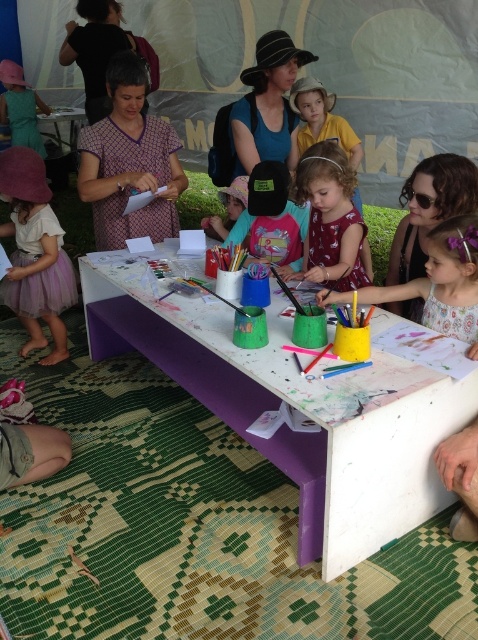
Is purple tulle skirt at lower left wider than matte pink dress at center?

Correct, the width of purple tulle skirt at lower left exceeds that of matte pink dress at center.

Between purple tulle skirt at lower left and matte pink dress at center, which one appears on the left side from the viewer's perspective?

Positioned to the left is purple tulle skirt at lower left.

Who is more distant from viewer, (63, 344) or (327, 188)?

Positioned behind is point (63, 344).

You are a GUI agent. You are given a task and a screenshot of the screen. Output one action in this format:
    pyautogui.click(x=<x>, y=<y>)
    Task: Click on the purple tulle skirt at lower left
    This screenshot has height=640, width=478.
    Given the screenshot: What is the action you would take?
    pyautogui.click(x=34, y=253)

Can you confirm if purple painted wood table at center is taller than pink fabric hat at center?

Yes, purple painted wood table at center is taller than pink fabric hat at center.

What do you see at coordinates (297, 408) in the screenshot? This screenshot has width=478, height=640. I see `purple painted wood table at center` at bounding box center [297, 408].

At what (x,y) coordinates should I click in order to perform the action: click on purple painted wood table at center. Please return your answer as a coordinate pair (x, y). Image resolution: width=478 pixels, height=640 pixels. Looking at the image, I should click on (297, 408).

Does matte yellow cup at center appear over pink fabric hat at center?

Actually, matte yellow cup at center is below pink fabric hat at center.

Who is taller, matte yellow cup at center or pink fabric hat at center?

Standing taller between the two is matte yellow cup at center.

Does point (475, 273) lie in front of point (230, 184)?

Yes, point (475, 273) is closer to viewer.

You are a GUI agent. You are given a task and a screenshot of the screen. Output one action in this format:
    pyautogui.click(x=<x>, y=<y>)
    Task: Click on the matte yellow cup at center
    This screenshot has width=478, height=640.
    Given the screenshot: What is the action you would take?
    pyautogui.click(x=443, y=282)